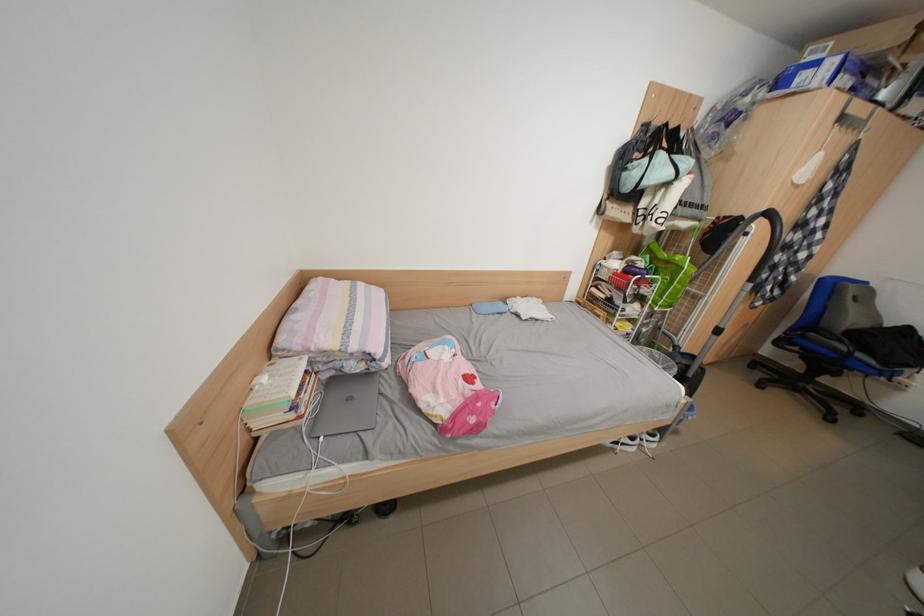
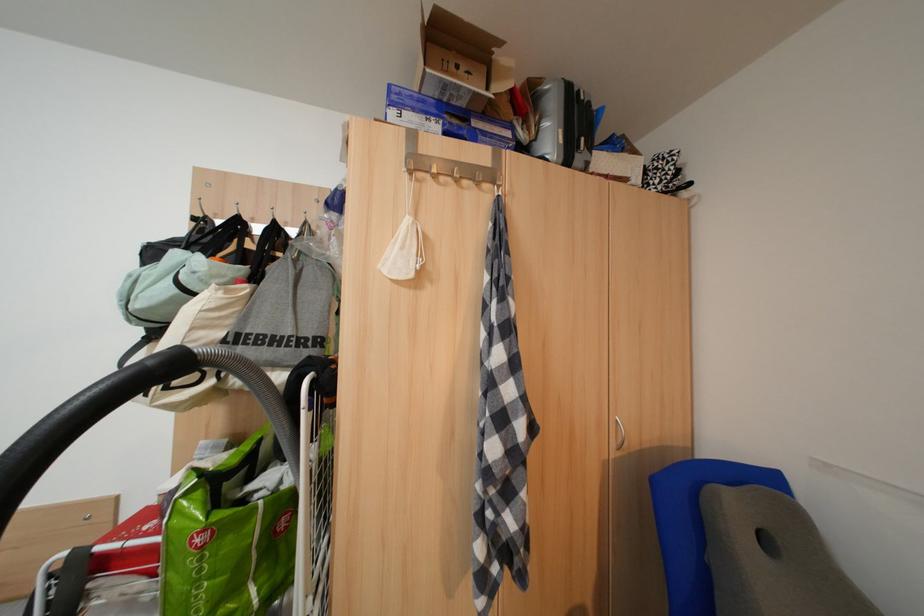
Based on the photo, what movement of the cameraman would produce the second image?

The cameraman walked toward right, forward.